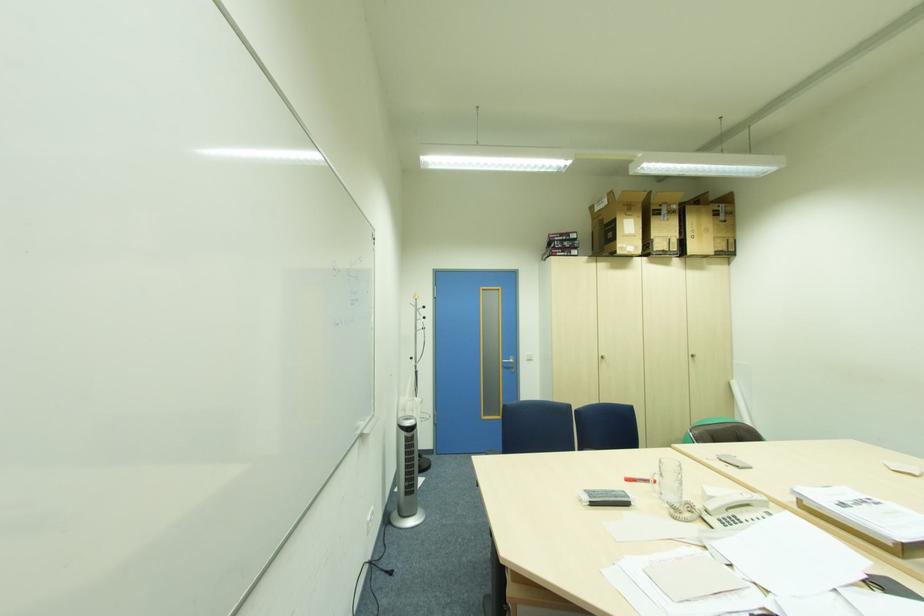
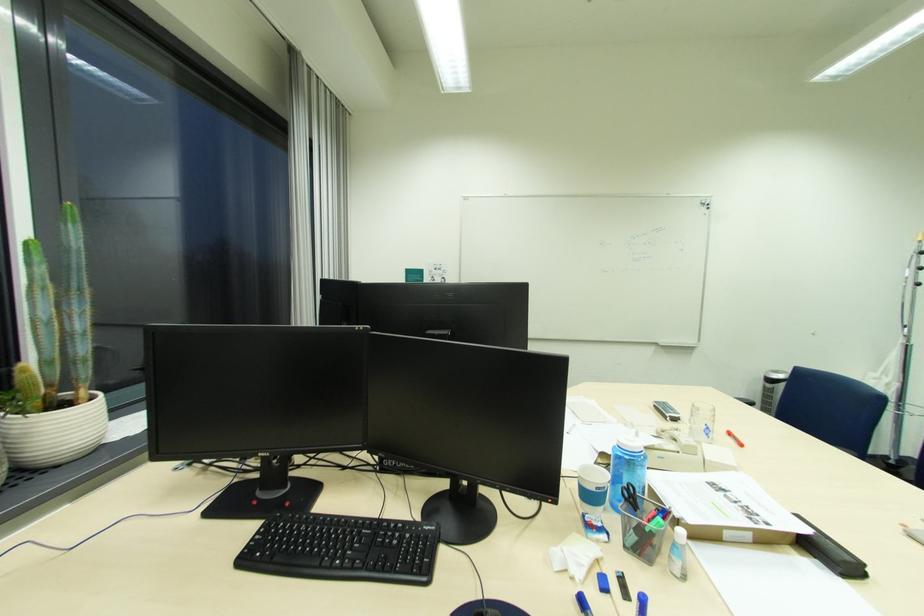
Find the pixel in the second image that matches pixel 849 504 in the first image.

(731, 491)